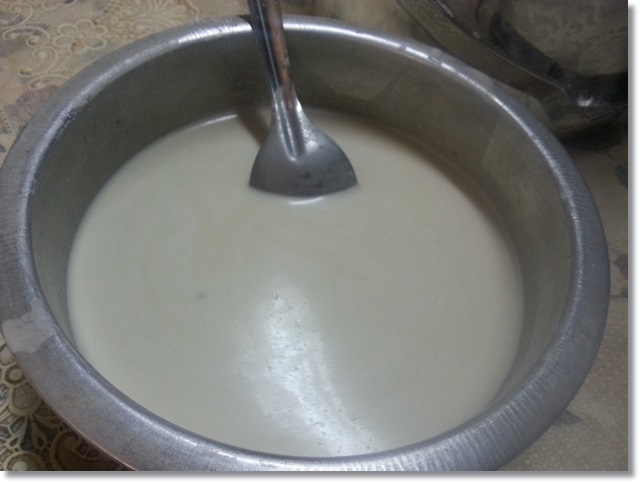
Locate an element on the screen. This screenshot has height=483, width=640. bottom left corner table cover is located at coordinates (10, 440), (60, 457).